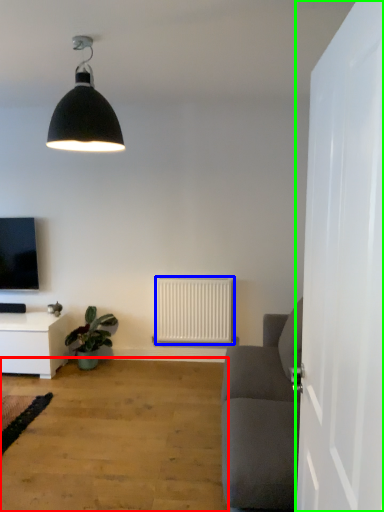
Question: Considering the real-world distances, which object is farthest from plain (highlighted by a red box)? radiator (highlighted by a blue box) or door (highlighted by a green box)?

Choices:
 (A) radiator
 (B) door

Answer: (B)